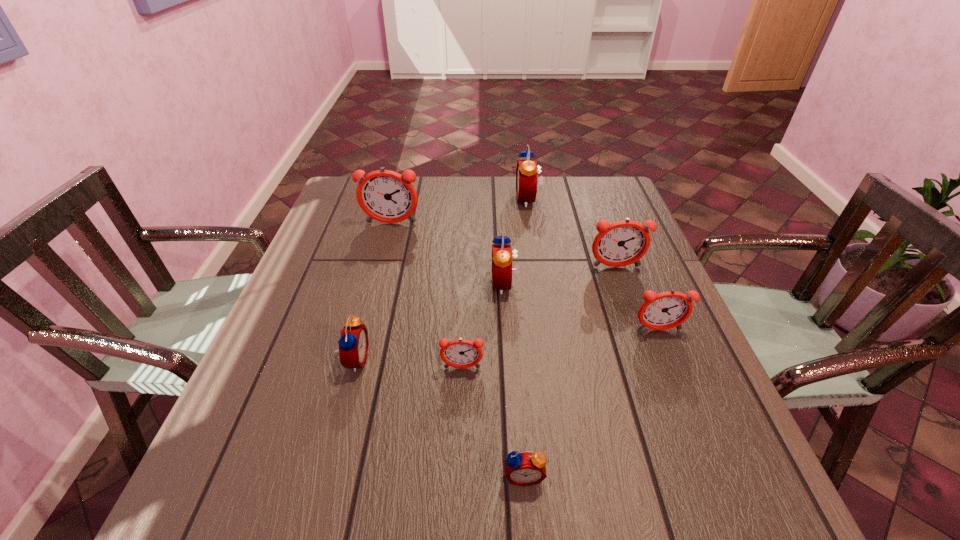
You are a GUI agent. You are given a task and a screenshot of the screen. Output one action in this format:
    pyautogui.click(x=<x>, y=<y>)
    Task: Click on the vacant space at the left edge of the desktop
    
    Given the screenshot: What is the action you would take?
    pyautogui.click(x=342, y=247)

Where is `vacant space at the right edge`? vacant space at the right edge is located at coordinates (676, 420).

In the image, there is a desktop. Where is `vacant space at the far right corner`? vacant space at the far right corner is located at coordinates (597, 196).

Find the location of a particular element. Image resolution: width=960 pixels, height=540 pixels. unoccupied area between the seventh nearest alarm clock and the second biggest red alarm clock is located at coordinates (447, 254).

Where is `empty space between the fourth nearest alarm clock and the nearest reddish-pink alarm clock`? Image resolution: width=960 pixels, height=540 pixels. empty space between the fourth nearest alarm clock and the nearest reddish-pink alarm clock is located at coordinates (561, 349).

The image size is (960, 540). Find the location of `vacant region between the third smallest red alarm clock and the nearest reddish-pink alarm clock`. vacant region between the third smallest red alarm clock and the nearest reddish-pink alarm clock is located at coordinates (483, 326).

At what (x,y) coordinates should I click in order to perform the action: click on free area in between the third smallest reddish-pink alarm clock and the third nearest red alarm clock. Please return your answer as a coordinate pair (x, y). Looking at the image, I should click on (560, 276).

Where is `vacant area between the second nearest reddish-pink alarm clock and the second farthest reddish-pink alarm clock`? This screenshot has width=960, height=540. vacant area between the second nearest reddish-pink alarm clock and the second farthest reddish-pink alarm clock is located at coordinates (637, 299).

Find the location of `vacant space that is in between the smallest red alarm clock and the third biggest red alarm clock`. vacant space that is in between the smallest red alarm clock and the third biggest red alarm clock is located at coordinates (440, 417).

Locate an element on the screen. The width and height of the screenshot is (960, 540). free space between the nearest object and the second biggest red alarm clock is located at coordinates (514, 380).